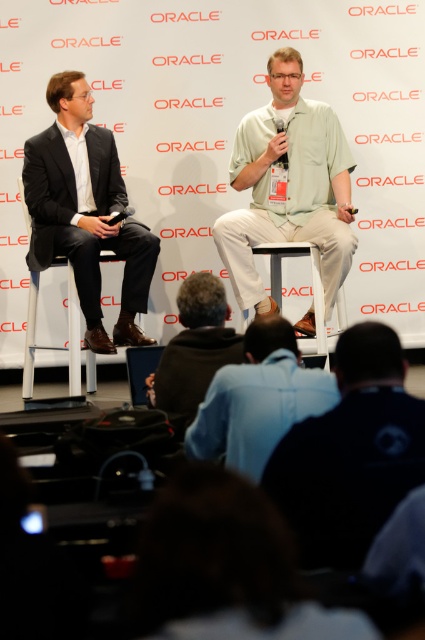
You are an event organizer checking the stage setup. You notice the light green fabric shirt at center and the matte black suit at left. Which one appears taller from the audience perspective?

The light green fabric shirt at center appears taller than the matte black suit at left from the audience perspective because it has a greater height according to the description.

You are an event organizer who needs to ensure that the light green fabric shirt at center and the white plastic chair at center do not overlap in the stage setup. Based on their sizes, which object should be placed further back to prevent overlapping?

The light green fabric shirt at center is wider than the white plastic chair at center. To prevent overlapping, the wider light green fabric shirt at center should be placed further back so that its greater width does not interfere with the chair.

You are an event organizer checking the stage setup for a formal event. You notice two items on the stage floor at lower center. One is the dark blue fabric shirt at lower center and the other is the dark brown leather jacket at lower center. Which item is positioned lower in the image?

The dark blue fabric shirt at lower center is below the dark brown leather jacket at lower center, so it is positioned lower in the image.